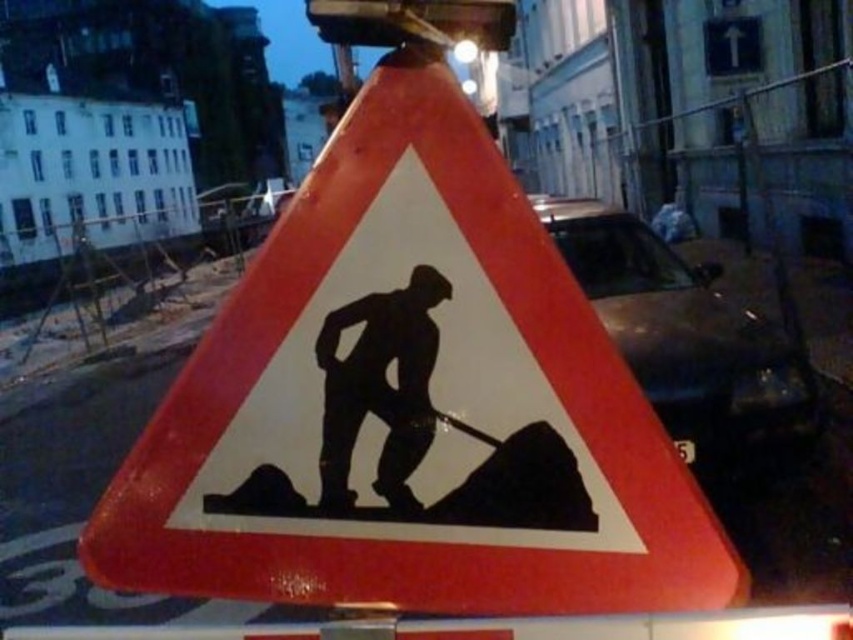
Which of these two, reflective plastic construction sign at center or black silhouette at center, stands shorter?

black silhouette at center is shorter.

Is point (531, 304) farther from camera compared to point (381, 380)?

No.

Between point (599, 573) and point (405, 493), which one is positioned behind?

Point (405, 493)

At what (x,y) coordinates should I click in order to perform the action: click on reflective plastic construction sign at center. Please return your answer as a coordinate pair (x, y). This screenshot has height=640, width=853. Looking at the image, I should click on (407, 403).